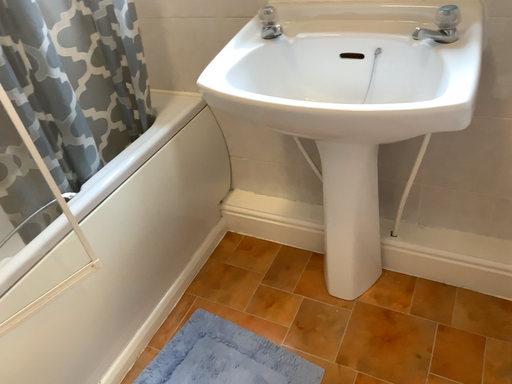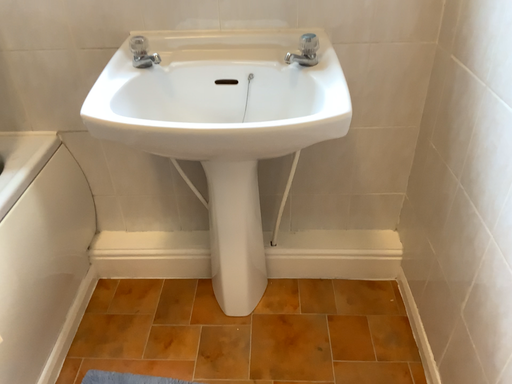
Question: Which way did the camera rotate in the video?

Choices:
 (A) rotated downward
 (B) rotated upward

Answer: (B)